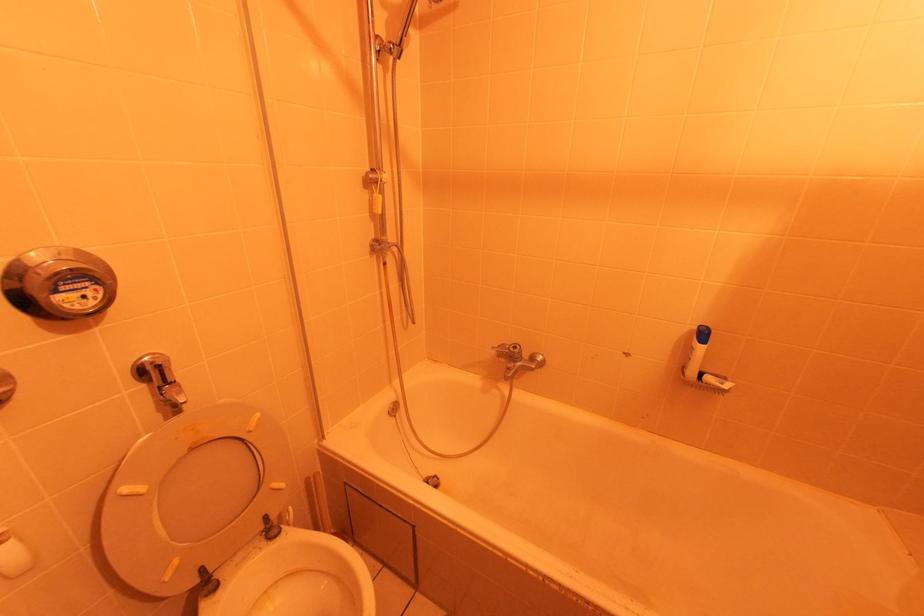
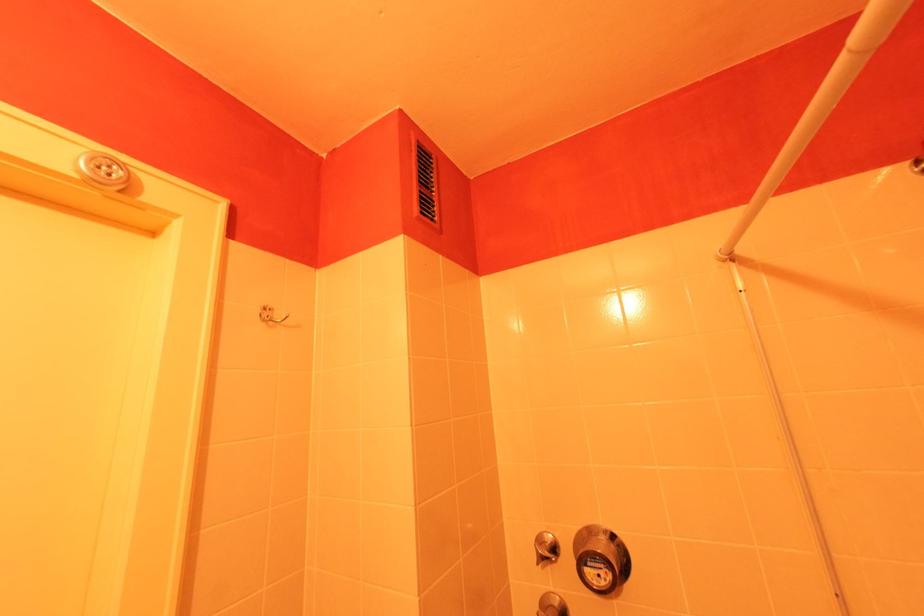
How did the camera likely rotate?

The camera's rotation is toward left-up.